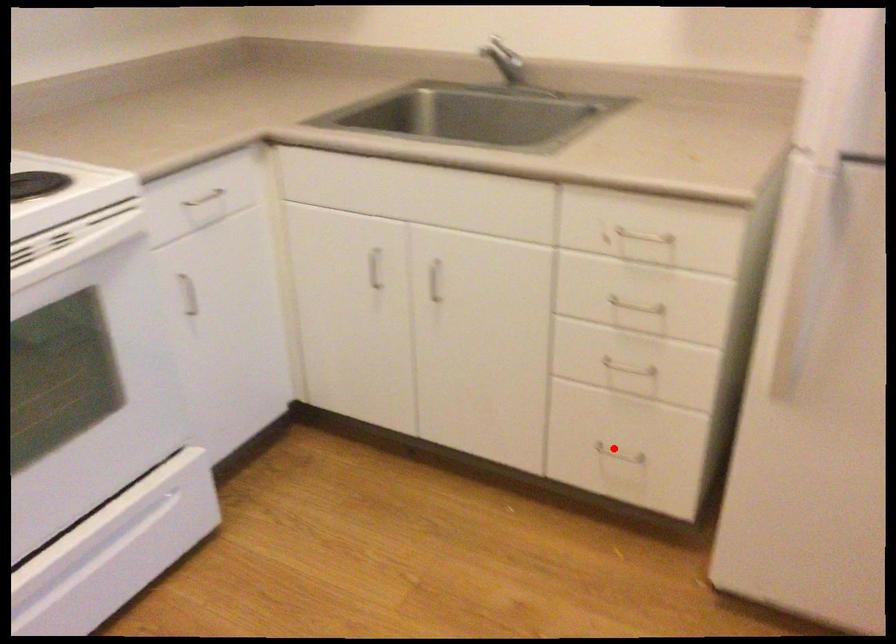
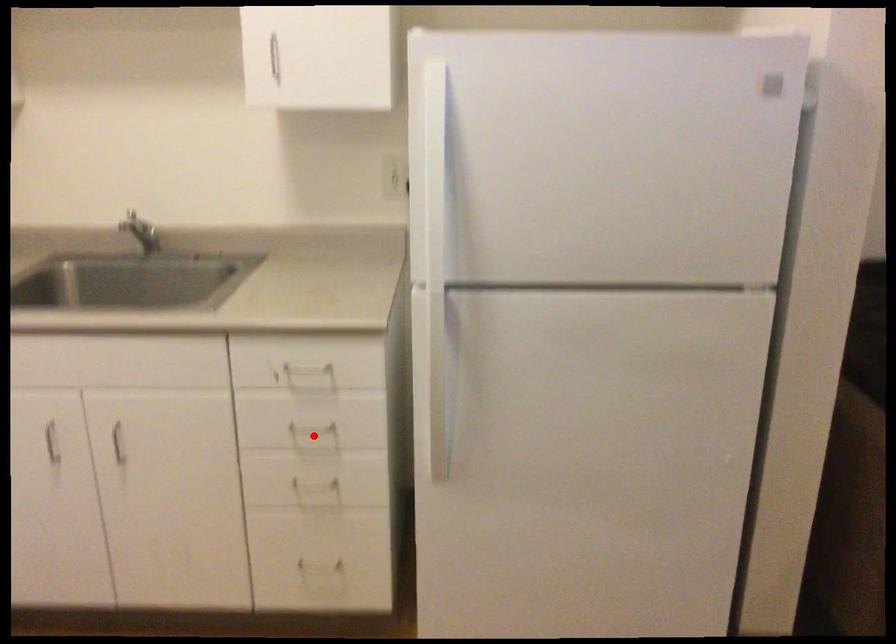
Based on the photo, I am providing you with two images of the same scene from different viewpoints. A red point is marked on the first image and another point is marked on the second image. Is the red point in image1 aligned with the point shown in image2?

No